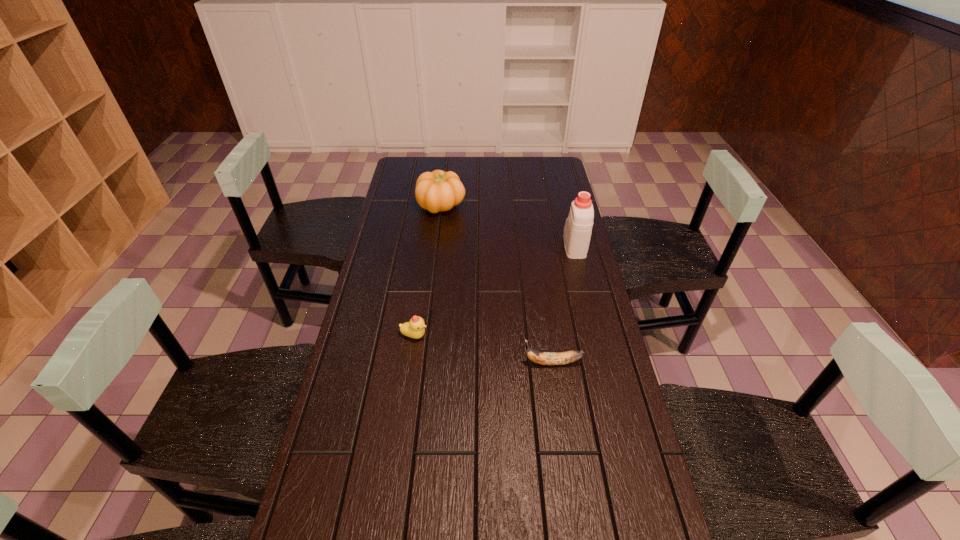
Locate an element on the screen. The height and width of the screenshot is (540, 960). free space at the left edge of the desktop is located at coordinates (386, 213).

In the image, there is a desktop. What are the coordinates of `vacant space at the right edge` in the screenshot? It's located at (605, 341).

Find the location of `vacant space at the far left corner of the desktop`. vacant space at the far left corner of the desktop is located at coordinates (405, 157).

The height and width of the screenshot is (540, 960). What are the coordinates of `vacant area between the second farthest object and the nearest object` in the screenshot? It's located at (564, 305).

Locate an element on the screen. This screenshot has width=960, height=540. free spot between the nearest object and the third farthest object is located at coordinates (484, 349).

Locate an element on the screen. empty space that is in between the duckling and the nearest object is located at coordinates (484, 349).

You are a GUI agent. You are given a task and a screenshot of the screen. Output one action in this format:
    pyautogui.click(x=<x>, y=<y>)
    Task: Click on the free space between the rightmost object and the third farthest object
    This screenshot has width=960, height=540.
    Given the screenshot: What is the action you would take?
    pyautogui.click(x=494, y=291)

Where is `vacant space that is in between the duckling and the farthest object`? Image resolution: width=960 pixels, height=540 pixels. vacant space that is in between the duckling and the farthest object is located at coordinates (428, 271).

Locate which object ranks second in proximity to the nearest object. Please provide its 2D coordinates. Your answer should be formatted as a tuple, i.e. [(x, y)], where the tuple contains the x and y coordinates of a point satisfying the conditions above.

[(578, 227)]

You are a GUI agent. You are given a task and a screenshot of the screen. Output one action in this format:
    pyautogui.click(x=<x>, y=<y>)
    Task: Click on the object that is the third closest one to the duckling
    The width and height of the screenshot is (960, 540).
    Given the screenshot: What is the action you would take?
    pyautogui.click(x=578, y=227)